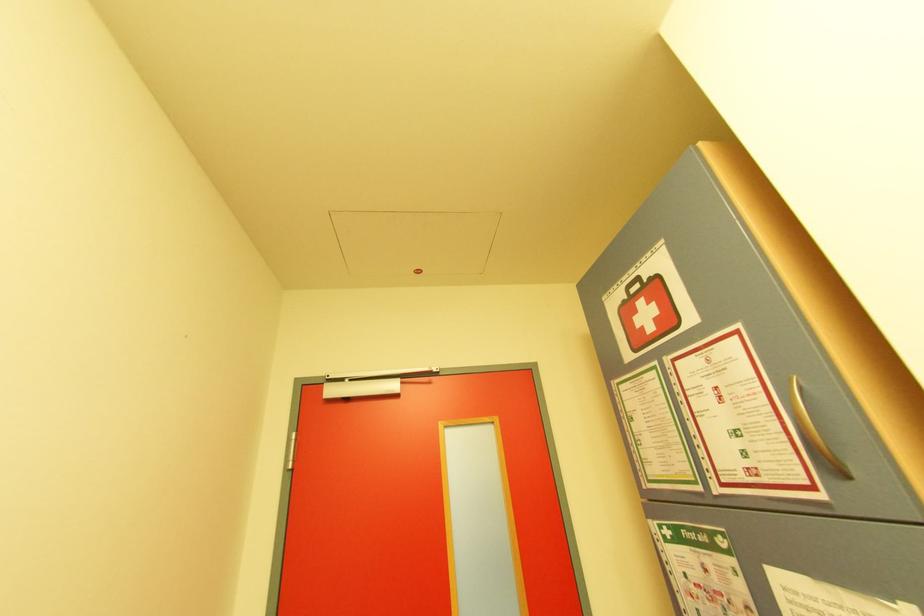
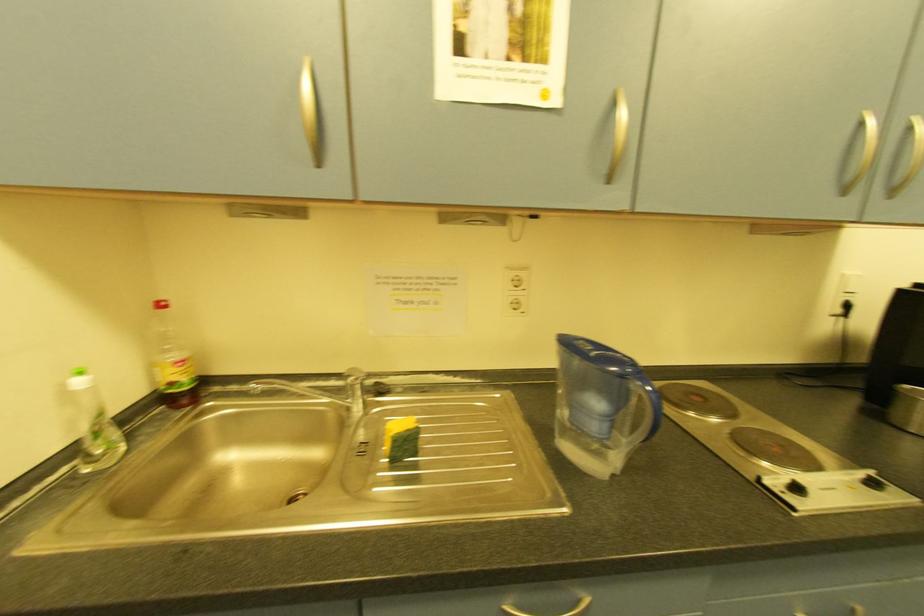
Question: The images are taken continuously from a first-person perspective. In which direction is your viewpoint rotating?

Choices:
 (A) Left
 (B) Right
 (C) Up
 (D) Down

Answer: (B)